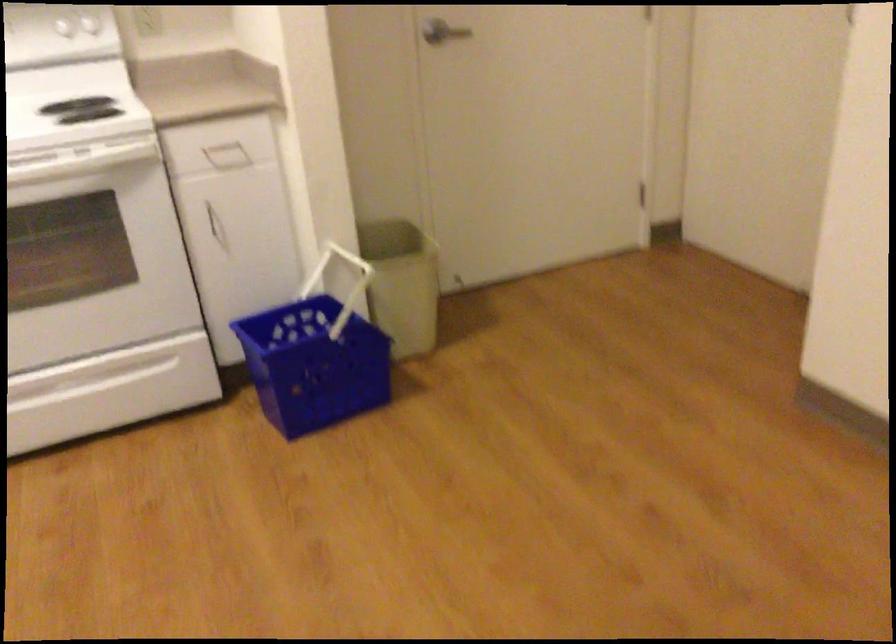
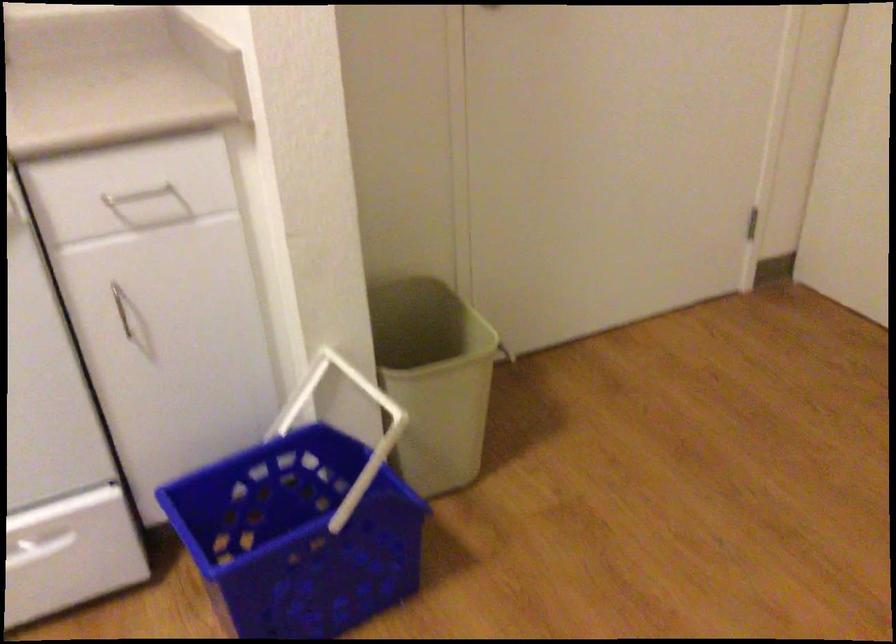
Where in the second image is the point corresponding to [400,267] from the first image?

(434, 379)